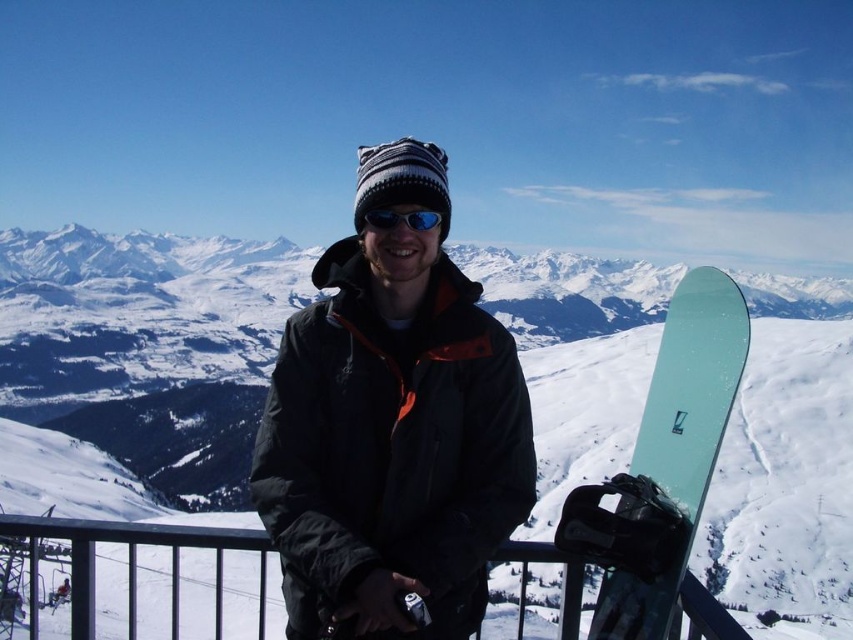
Is black matte jacket at center further to camera compared to translucent teal snowboard at lower right?

Yes, it is behind translucent teal snowboard at lower right.

From the picture: Which is more to the left, black matte jacket at center or translucent teal snowboard at lower right?

black matte jacket at center is more to the left.

Does point (416, 422) lie in front of point (672, 484)?

No, (416, 422) is behind (672, 484).

This screenshot has width=853, height=640. What are the coordinates of `black matte jacket at center` in the screenshot? It's located at (392, 424).

Can you confirm if white matte snowboard at center is positioned to the left of sunglasses at center?

Incorrect, white matte snowboard at center is not on the left side of sunglasses at center.

Between point (169, 420) and point (433, 225), which one is positioned in front?

Positioned in front is point (433, 225).

You are a GUI agent. You are given a task and a screenshot of the screen. Output one action in this format:
    pyautogui.click(x=<x>, y=<y>)
    Task: Click on the white matte snowboard at center
    Image resolution: width=853 pixels, height=640 pixels.
    Given the screenshot: What is the action you would take?
    pyautogui.click(x=148, y=353)

Between translucent teal snowboard at lower right and sunglasses at center, which one is positioned lower?

translucent teal snowboard at lower right is below.

What do you see at coordinates (680, 435) in the screenshot? This screenshot has height=640, width=853. I see `translucent teal snowboard at lower right` at bounding box center [680, 435].

Locate an element on the screen. The width and height of the screenshot is (853, 640). translucent teal snowboard at lower right is located at coordinates [x=680, y=435].